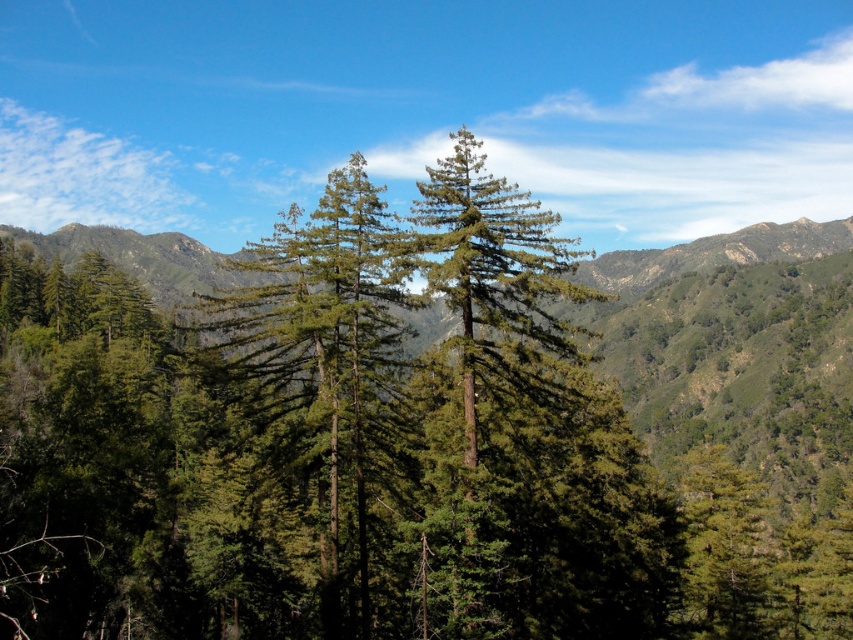
Question: Is green matte tree at center to the left of green needle-like at center from the viewer's perspective?

Choices:
 (A) yes
 (B) no

Answer: (A)

Question: Which object appears closest to the camera in this image?

Choices:
 (A) green needle-like at center
 (B) green matte tree at center

Answer: (A)

Question: Which object appears closest to the camera in this image?

Choices:
 (A) green needle-like at center
 (B) green matte tree at center

Answer: (A)

Question: Does green matte tree at center have a larger size compared to green needle-like at center?

Choices:
 (A) no
 (B) yes

Answer: (B)

Question: Among these points, which one is farthest from the camera?

Choices:
 (A) (374, 380)
 (B) (451, 170)

Answer: (B)

Question: Considering the relative positions of green matte tree at center and green needle-like at center in the image provided, where is green matte tree at center located with respect to green needle-like at center?

Choices:
 (A) below
 (B) above

Answer: (A)